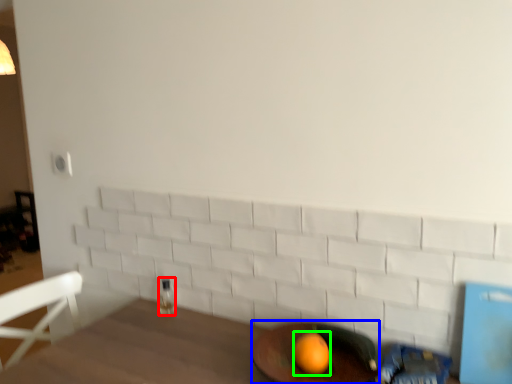
Question: Which is farther away from beverage (highlighted by a red box)? round table (highlighted by a blue box) or orange (highlighted by a green box)?

Choices:
 (A) round table
 (B) orange

Answer: (B)